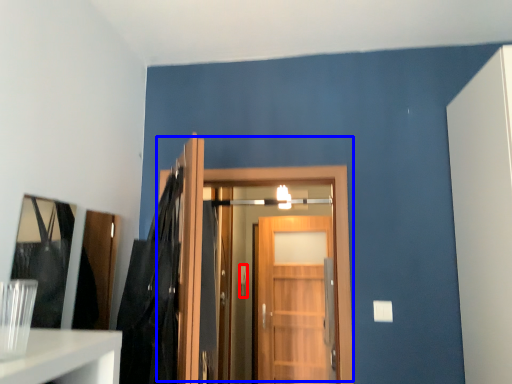
Question: Which object appears closest to the camera in this image, door handle (highlighted by a red box) or door (highlighted by a blue box)?

Choices:
 (A) door handle
 (B) door

Answer: (B)